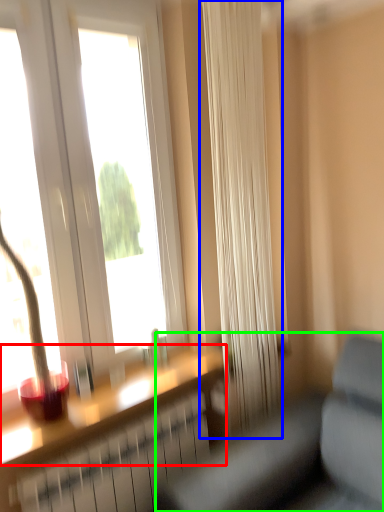
Question: Which object is the closest to the window sill (highlighted by a red box)? Choose among these: curtain (highlighted by a blue box) or studio couch (highlighted by a green box).

Choices:
 (A) curtain
 (B) studio couch

Answer: (B)